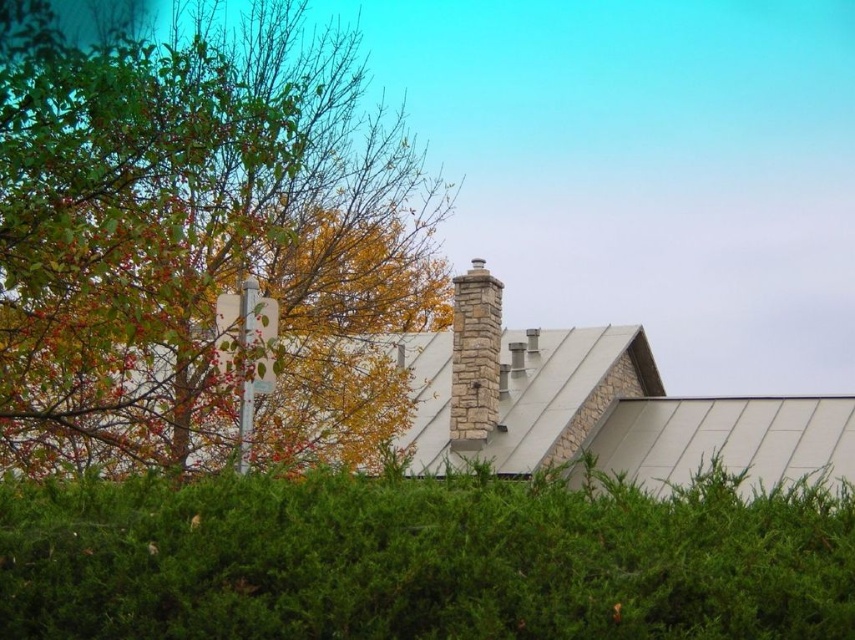
Question: Can you confirm if green leafy hedge at center is smaller than stone chimney at center?

Choices:
 (A) yes
 (B) no

Answer: (B)

Question: Estimate the real-world distances between objects in this image. Which object is farther from the green leafy hedge at center?

Choices:
 (A) stone chimney at center
 (B) green leafy tree at upper left

Answer: (A)

Question: Among these objects, which one is nearest to the camera?

Choices:
 (A) stone chimney at center
 (B) green leafy hedge at center

Answer: (B)

Question: Can you confirm if green leafy tree at upper left is positioned to the left of stone chimney at center?

Choices:
 (A) no
 (B) yes

Answer: (B)

Question: Estimate the real-world distances between objects in this image. Which object is farther from the green leafy tree at upper left?

Choices:
 (A) stone chimney at center
 (B) green leafy hedge at center

Answer: (B)

Question: Is green leafy tree at upper left to the right of stone chimney at center from the viewer's perspective?

Choices:
 (A) yes
 (B) no

Answer: (B)